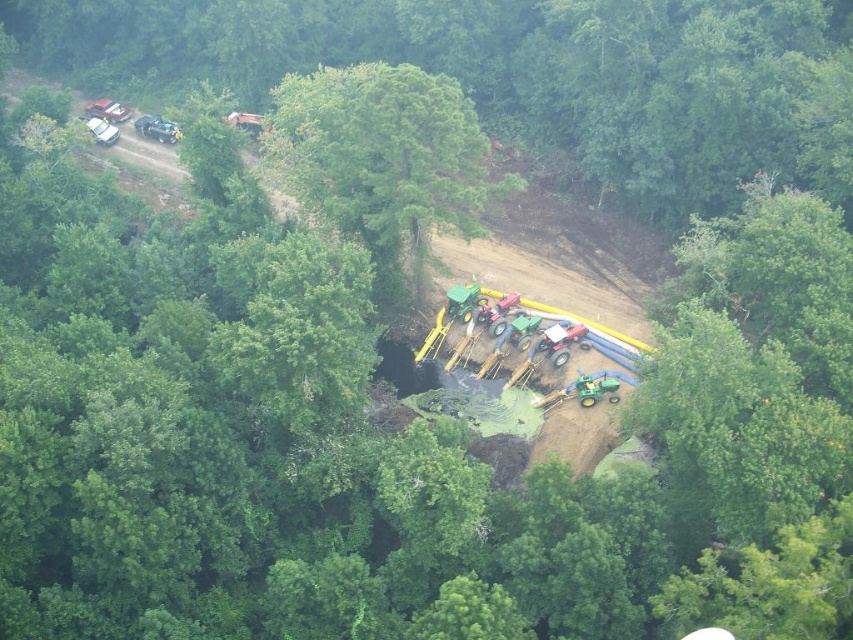
Between green leafy tree at upper center and green leafy tree at center, which one is positioned higher?

green leafy tree at upper center is higher up.

Which is behind, point (628, 38) or point (344, 216)?

Positioned behind is point (628, 38).

Which is in front, point (314, 36) or point (427, 189)?

Point (427, 189) is in front.

I want to click on green leafy tree at upper center, so click(x=521, y=74).